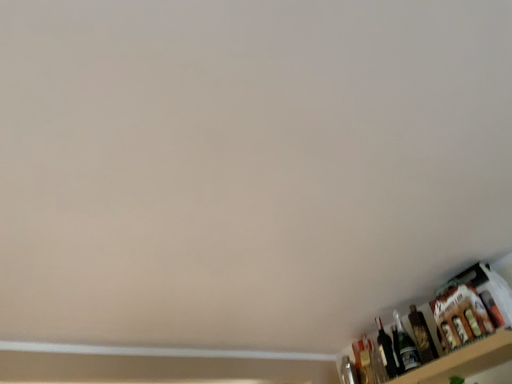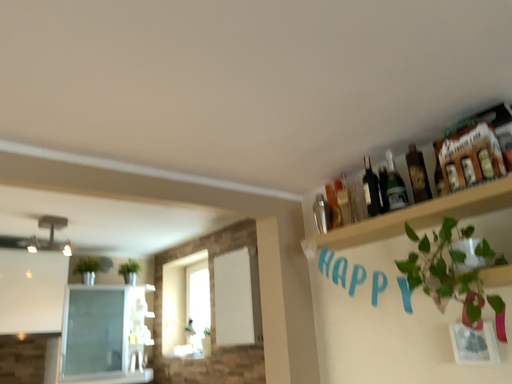
Question: Which way did the camera rotate in the video?

Choices:
 (A) rotated left
 (B) rotated right

Answer: (B)